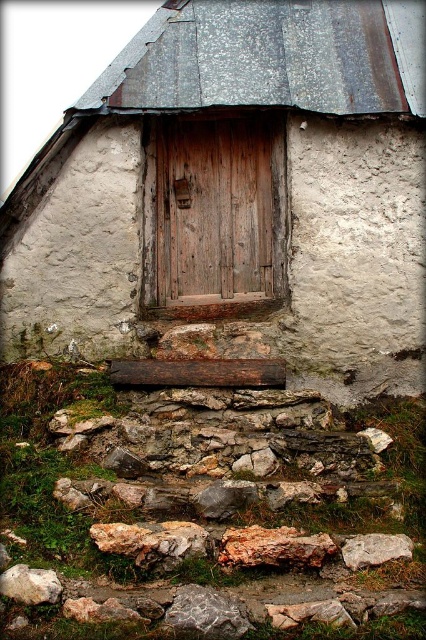
You are standing in front of the stone building and see the point labeled as point (374, 548). What is the material of the surface where this point is located?

The point (374, 548) is located on gray rough rock at lower right.

You are standing in front of the stone building and notice two rocks at the base of the structure. The gray rough rock at lower right and the speckled gray rock at lower left. Which rock is positioned higher up relative to the other?

The gray rough rock at lower right is located above the speckled gray rock at lower left, so it is positioned higher up.